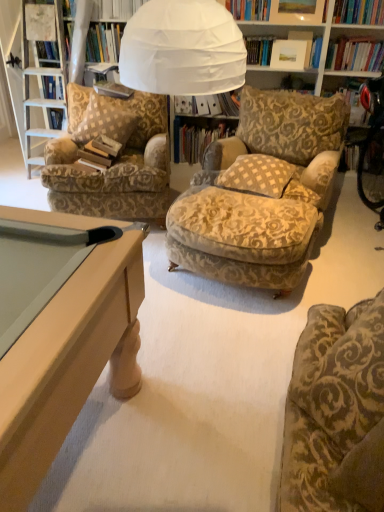
Find the location of a particular element. brown paper book at center, marked as the first book in a front-to-back arrangement is located at coordinates (100, 152).

The height and width of the screenshot is (512, 384). What do you see at coordinates (105, 120) in the screenshot?
I see `patterned fabric pillow at left, which is the first pillow in left-to-right order` at bounding box center [105, 120].

In order to face velvet gold-patterned chair at lower right, arranged as the first chair when ordered from the bottom, should I rotate leftwards or rightwards?

To align with it, rotate right about 25.802°.

The width and height of the screenshot is (384, 512). What are the coordinates of `velvet gold-patterned chair at lower right, which is the 1th chair in right-to-left order` in the screenshot? It's located at (335, 412).

Measure the distance between point [227,124] and camera.

Point [227,124] is 3.57 meters away from camera.

You are a GUI agent. You are given a task and a screenshot of the screen. Output one action in this format:
    pyautogui.click(x=<x>, y=<y>)
    Task: Click on the hardcover book at center, the 4th book from the front
    
    Given the screenshot: What is the action you would take?
    pyautogui.click(x=198, y=136)

Measure the distance between patterned fabric armchair at left, which is the 2th chair from front to back, and camera.

patterned fabric armchair at left, which is the 2th chair from front to back, is 2.79 meters from camera.

Where is `brown paper book at center, marked as the first book in a front-to-back arrangement`? brown paper book at center, marked as the first book in a front-to-back arrangement is located at coordinates (100, 152).

Does point (189, 112) lie behind point (116, 142)?

Yes, point (189, 112) is behind point (116, 142).

From a real-world perspective, who is located higher, white paper book at center, the third book viewed from the front, or brown paper book at center, arranged as the 4th book when viewed from the back?

white paper book at center, the third book viewed from the front.

Between white paper book at center, placed as the second book when sorted from back to front, and brown paper book at center, arranged as the 4th book when viewed from the back, which one has smaller width?

With smaller width is brown paper book at center, arranged as the 4th book when viewed from the back.

Would you say velvet gold-patterned chair at lower right, which appears as the first chair when viewed from the front, is outside white paper book at center, the third book viewed from the front?

velvet gold-patterned chair at lower right, which appears as the first chair when viewed from the front, lies outside white paper book at center, the third book viewed from the front,'s area.

Does velvet gold-patterned chair at lower right, which appears as the first chair when viewed from the front, have a larger size compared to white paper book at center, the third book viewed from the front?

Yes.

Which is in front, point (347, 443) or point (193, 97)?

Point (347, 443)

Which of these two, velvet gold-patterned chair at lower right, which is the 2th chair from left to right, or white paper book at center, the third book viewed from the front, is thinner?

With smaller width is white paper book at center, the third book viewed from the front.

Which is in front, point (332, 362) or point (277, 179)?

The point (332, 362) is closer.

Between velvet gold-patterned chair at lower right, which is the 2th chair from left to right, and checkered fabric pillow at center, which is counted as the second pillow, starting from the left, which one has more height?

velvet gold-patterned chair at lower right, which is the 2th chair from left to right.

Is velvet gold-patterned chair at lower right, which appears as the first chair when viewed from the front, inside or outside of checkered fabric pillow at center, which is counted as the first pillow, starting from the right?

velvet gold-patterned chair at lower right, which appears as the first chair when viewed from the front, cannot be found inside checkered fabric pillow at center, which is counted as the first pillow, starting from the right.

Looking at this image, could you tell me if velvet gold-patterned chair at lower right, which is the 1th chair in right-to-left order, is facing checkered fabric pillow at center, which is counted as the first pillow, starting from the right?

No.

Which object is closer to the camera taking this photo, velvet gold-patterned chair at lower right, which is the 2th chair in back-to-front order, or patterned fabric pillow at left, which is the 2th pillow from right to left?

velvet gold-patterned chair at lower right, which is the 2th chair in back-to-front order, is in front.

In the scene shown: How much distance is there between velvet gold-patterned chair at lower right, which is the 1th chair in right-to-left order, and patterned fabric pillow at left, which is the first pillow in left-to-right order?

velvet gold-patterned chair at lower right, which is the 1th chair in right-to-left order, and patterned fabric pillow at left, which is the first pillow in left-to-right order, are 2.28 meters apart from each other.

Is velvet gold-patterned chair at lower right, the 2th chair when ordered from top to bottom, bigger or smaller than patterned fabric pillow at left, which is the first pillow in left-to-right order?

Clearly, velvet gold-patterned chair at lower right, the 2th chair when ordered from top to bottom, is smaller in size than patterned fabric pillow at left, which is the first pillow in left-to-right order.

From a real-world perspective, is velvet gold-patterned chair at lower right, arranged as the first chair when ordered from the bottom, physically below patterned fabric pillow at left, which is the first pillow in left-to-right order?

No, from a real-world perspective, velvet gold-patterned chair at lower right, arranged as the first chair when ordered from the bottom, is not beneath patterned fabric pillow at left, which is the first pillow in left-to-right order.

From the image's perspective, does patterned fabric pillow at left, which is the 2th pillow from right to left, appear lower than hardcover book at center, positioned as the 1th book in back-to-front order?

Correct, patterned fabric pillow at left, which is the 2th pillow from right to left, appears lower than hardcover book at center, positioned as the 1th book in back-to-front order, in the image.

Can you confirm if patterned fabric pillow at left, which is the first pillow in left-to-right order, is wider than hardcover book at center, positioned as the 1th book in back-to-front order?

Correct, the width of patterned fabric pillow at left, which is the first pillow in left-to-right order, exceeds that of hardcover book at center, positioned as the 1th book in back-to-front order.

From a real-world perspective, which is physically above, patterned fabric pillow at left, which is the 2th pillow from right to left, or hardcover book at center, positioned as the 1th book in back-to-front order?

patterned fabric pillow at left, which is the 2th pillow from right to left.

Is patterned fabric pillow at left, which is the first pillow in left-to-right order, to the left or to the right of hardcover book at center, positioned as the 1th book in back-to-front order, in the image?

In the image, patterned fabric pillow at left, which is the first pillow in left-to-right order, appears on the left side of hardcover book at center, positioned as the 1th book in back-to-front order.

Which object is thinner, hardcover book at center, which is counted as the 3th book, starting from the back, or white paper book at center, the third book viewed from the front?

With smaller width is hardcover book at center, which is counted as the 3th book, starting from the back.

Is point (125, 88) closer to camera compared to point (188, 103)?

Yes, it is.

Is hardcover book at center, the 2th book when ordered from front to back, situated inside white paper book at center, placed as the second book when sorted from back to front, or outside?

hardcover book at center, the 2th book when ordered from front to back, cannot be found inside white paper book at center, placed as the second book when sorted from back to front.

How different are the orientations of hardcover book at center, the 2th book when ordered from front to back, and white paper book at center, the third book viewed from the front, in degrees?

They differ by 3.26 degrees in their facing directions.

Does patterned fabric pillow at left, which is the first pillow in left-to-right order, have a smaller size compared to checkered fabric pillow at center, which is counted as the second pillow, starting from the left?

Actually, patterned fabric pillow at left, which is the first pillow in left-to-right order, might be larger than checkered fabric pillow at center, which is counted as the second pillow, starting from the left.

Is there a large distance between patterned fabric pillow at left, which is the first pillow in left-to-right order, and checkered fabric pillow at center, which is counted as the first pillow, starting from the right?

patterned fabric pillow at left, which is the first pillow in left-to-right order, is far away from checkered fabric pillow at center, which is counted as the first pillow, starting from the right.

From the image's perspective, does patterned fabric pillow at left, which is the first pillow in left-to-right order, appear higher than checkered fabric pillow at center, which is counted as the first pillow, starting from the right?

Yes, from the image's perspective, patterned fabric pillow at left, which is the first pillow in left-to-right order, is on top of checkered fabric pillow at center, which is counted as the first pillow, starting from the right.

From the picture: Is patterned fabric pillow at left, which is the first pillow in left-to-right order, aimed at checkered fabric pillow at center, which is counted as the second pillow, starting from the left?

No, patterned fabric pillow at left, which is the first pillow in left-to-right order, does not turn towards checkered fabric pillow at center, which is counted as the second pillow, starting from the left.

From the white paper book at center, placed as the second book when sorted from back to front, count 2nd books forward and point to it. Please provide its 2D coordinates.

[(100, 152)]

Where is `the 1st book directly beneath the velvet gold-patterned chair at lower right, which appears as the first chair when viewed from the front (from a real-world perspective)`? the 1st book directly beneath the velvet gold-patterned chair at lower right, which appears as the first chair when viewed from the front (from a real-world perspective) is located at coordinates (208, 104).

Which object lies further to the anchor point checkered fabric pillow at center, which is counted as the first pillow, starting from the right, brown paper book at center, marked as the first book in a front-to-back arrangement, or patterned fabric armchair at left, the first chair when ordered from back to front?

Among the two, brown paper book at center, marked as the first book in a front-to-back arrangement, is located further to checkered fabric pillow at center, which is counted as the first pillow, starting from the right.

Looking at the image, which one is located further to checkered fabric pillow at center, which is counted as the second pillow, starting from the left, patterned fabric pillow at left, which is the 2th pillow from right to left, or hardcover book at center, the 2th book when ordered from front to back?

hardcover book at center, the 2th book when ordered from front to back, is positioned further to the anchor checkered fabric pillow at center, which is counted as the second pillow, starting from the left.

Considering their positions, is patterned fabric armchair at left, placed as the first chair when sorted from top to bottom, positioned further to hardcover book at center, positioned as the 1th book in back-to-front order, than hardcover book at center, the 2th book when ordered from front to back?

patterned fabric armchair at left, placed as the first chair when sorted from top to bottom.

From the image, which object appears to be farther from hardcover book at center, the 4th book from the front, checkered fabric pillow at center, which is counted as the second pillow, starting from the left, or white paper book at center, placed as the second book when sorted from back to front?

Based on the image, checkered fabric pillow at center, which is counted as the second pillow, starting from the left, appears to be further to hardcover book at center, the 4th book from the front.

When comparing their distances from patterned fabric armchair at left, the 2th chair from the right, does patterned fabric pillow at left, which is the 2th pillow from right to left, or brown paper book at center, marked as the first book in a front-to-back arrangement, seem further?

Among the two, brown paper book at center, marked as the first book in a front-to-back arrangement, is located further to patterned fabric armchair at left, the 2th chair from the right.

Estimate the real-world distances between objects in this image. Which object is closer to velvet gold-patterned chair at lower right, arranged as the first chair when ordered from the bottom, white paper book at center, placed as the second book when sorted from back to front, or patterned fabric armchair at left, the 2th chair from the right?

patterned fabric armchair at left, the 2th chair from the right, is positioned closer to the anchor velvet gold-patterned chair at lower right, arranged as the first chair when ordered from the bottom.

From the image, which object appears to be farther from brown paper book at center, arranged as the 4th book when viewed from the back, hardcover book at center, which is counted as the 3th book, starting from the back, or white paper book at center, placed as the second book when sorted from back to front?

Based on the image, white paper book at center, placed as the second book when sorted from back to front, appears to be further to brown paper book at center, arranged as the 4th book when viewed from the back.

Considering their positions, is brown paper book at center, marked as the first book in a front-to-back arrangement, positioned closer to hardcover book at center, the 2th book when ordered from front to back, than patterned fabric armchair at left, which is the 2th chair from front to back?

Based on the image, patterned fabric armchair at left, which is the 2th chair from front to back, appears to be nearer to hardcover book at center, the 2th book when ordered from front to back.

Locate an element on the screen. This screenshot has height=512, width=384. chair between checkered fabric pillow at center, which is counted as the second pillow, starting from the left, and white paper book at center, placed as the second book when sorted from back to front, from front to back is located at coordinates (114, 163).

The width and height of the screenshot is (384, 512). Find the location of `pillow positioned between velvet gold-patterned chair at lower right, the 2th chair when ordered from top to bottom, and brown paper book at center, arranged as the 4th book when viewed from the back, from near to far`. pillow positioned between velvet gold-patterned chair at lower right, the 2th chair when ordered from top to bottom, and brown paper book at center, arranged as the 4th book when viewed from the back, from near to far is located at coordinates (257, 175).

I want to click on book situated between brown paper book at center, marked as the first book in a front-to-back arrangement, and hardcover book at center, positioned as the 1th book in back-to-front order, from left to right, so click(x=113, y=89).

I want to click on pillow located between brown paper book at center, marked as the first book in a front-to-back arrangement, and checkered fabric pillow at center, which is counted as the second pillow, starting from the left, in the left-right direction, so click(105, 120).